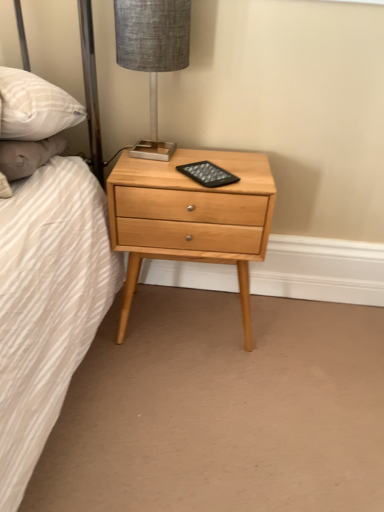
Locate an element on the screen. Image resolution: width=384 pixels, height=512 pixels. vacant location below textured gray fabric lampshade at upper center (from a real-world perspective) is located at coordinates (146, 152).